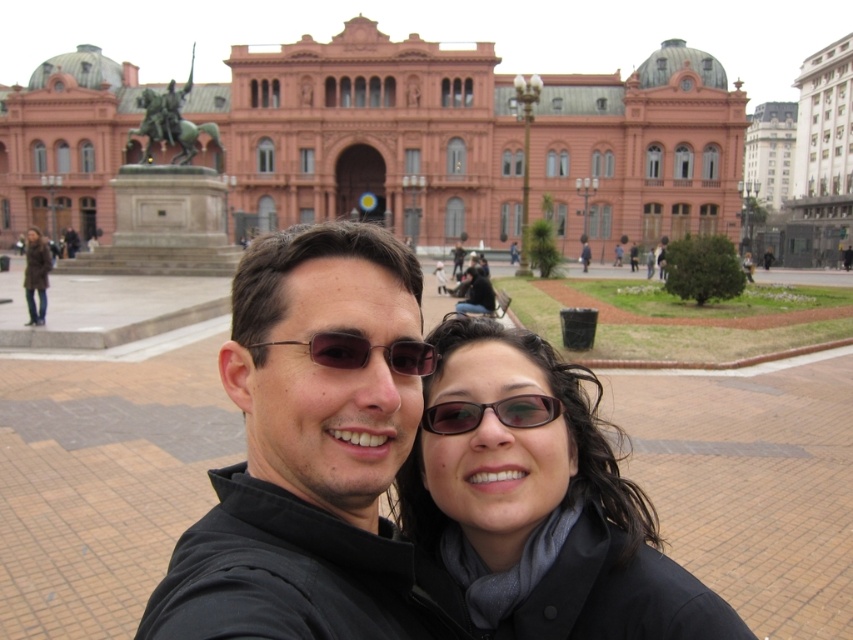
Measure the distance between black matte jacket at center and matte black jacket at center.

A distance of 5.89 feet exists between black matte jacket at center and matte black jacket at center.

Does point (532, 522) lie behind point (547, 435)?

No, it is not.

Who is more forward, (474,586) or (505,333)?

Positioned in front is point (474,586).

Locate an element on the screen. Image resolution: width=853 pixels, height=640 pixels. black matte jacket at center is located at coordinates (537, 509).

Consider the image. Can you confirm if black matte jacket at center is positioned to the right of brown leather jacket at upper left?

Yes, black matte jacket at center is to the right of brown leather jacket at upper left.

Locate an element on the screen. Image resolution: width=853 pixels, height=640 pixels. black matte jacket at center is located at coordinates (537, 509).

Locate an element on the screen. black matte jacket at center is located at coordinates (537, 509).

Which of these two, pink stone building at center or brown leather jacket at upper left, stands taller?

pink stone building at center

Which of these two, pink stone building at center or brown leather jacket at upper left, stands shorter?

With less height is brown leather jacket at upper left.

Who is more distant from viewer, (x=560, y=220) or (x=38, y=272)?

Positioned behind is point (x=560, y=220).

The image size is (853, 640). I want to click on pink stone building at center, so click(x=367, y=136).